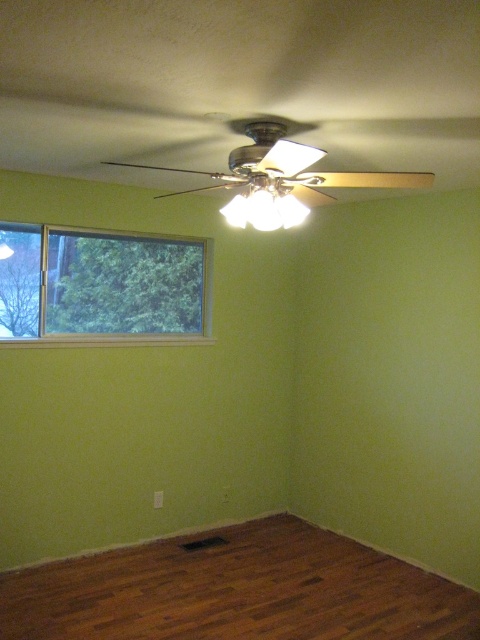
Is point (126, 584) positioned after point (122, 337)?

No, (126, 584) is closer to viewer.

This screenshot has width=480, height=640. Describe the element at coordinates (237, 589) in the screenshot. I see `brown wood floor at lower center` at that location.

This screenshot has height=640, width=480. I want to click on brown wood floor at lower center, so click(x=237, y=589).